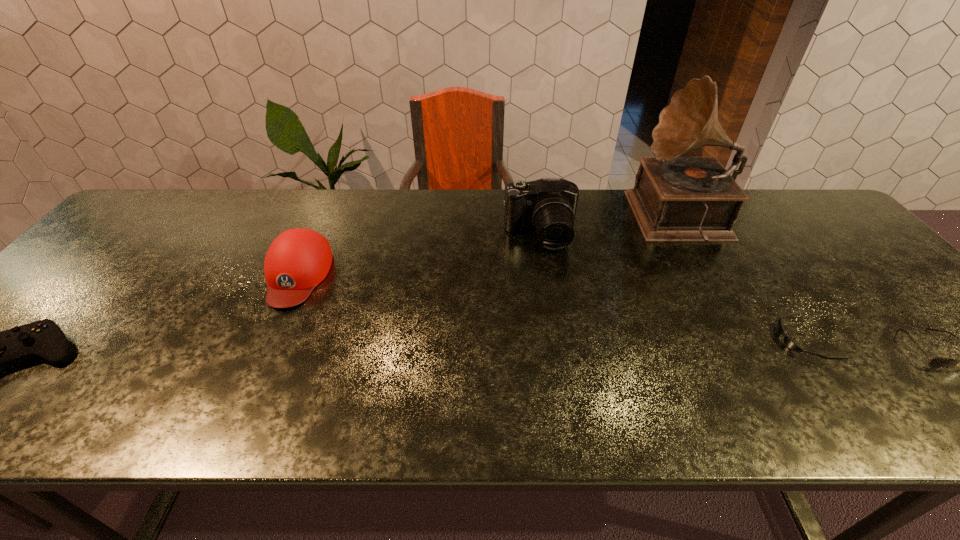
Find the location of a particular element. The image size is (960, 540). blank space located on the lens of the fourth object from right to left is located at coordinates (562, 373).

Locate an element on the screen. free space located 0.140m on the front-facing side of the second object from left to right is located at coordinates (260, 360).

This screenshot has width=960, height=540. In order to click on vacant space located 0.210m on the front-facing side of the shortest object in this screenshot , I will do `click(686, 339)`.

The width and height of the screenshot is (960, 540). Identify the location of vacant area situated on the front-facing side of the shortest object. coord(646,339).

The image size is (960, 540). In order to click on free location located 0.310m on the front-facing side of the shortest object in this screenshot , I will do `click(642, 339)`.

This screenshot has height=540, width=960. What are the coordinates of `record player that is at the far edge` in the screenshot? It's located at (675, 198).

The height and width of the screenshot is (540, 960). I want to click on camera located in the far edge section of the desktop, so click(x=548, y=205).

Where is `vacant space at the far edge of the desktop`? The width and height of the screenshot is (960, 540). vacant space at the far edge of the desktop is located at coordinates (228, 205).

Identify the location of vacant space at the near edge of the desktop. The height and width of the screenshot is (540, 960). (772, 406).

This screenshot has width=960, height=540. In the image, there is a desktop. Find the location of `vacant area at the left edge`. vacant area at the left edge is located at coordinates (102, 274).